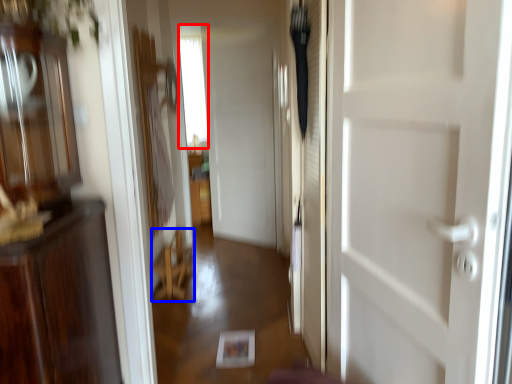
Question: Which object appears farthest to the camera in this image, window (highlighted by a red box) or furniture (highlighted by a blue box)?

Choices:
 (A) window
 (B) furniture

Answer: (A)